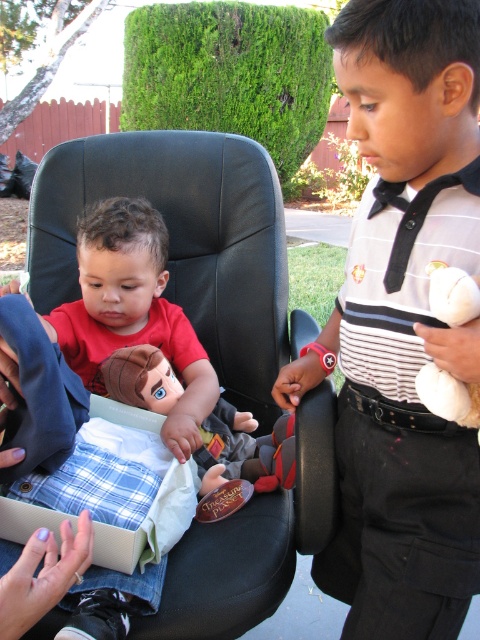
Based on the photo, between white striped shirt at center and black leather armchair at center, which one has less height?

white striped shirt at center is shorter.

Between point (402, 609) and point (201, 321), which one is positioned behind?

The point (201, 321) is more distant.

Is point (399, 620) farther from viewer compared to point (335, 484)?

No, (399, 620) is closer to viewer.

Image resolution: width=480 pixels, height=640 pixels. Identify the location of white striped shirt at center. (403, 323).

Is white striped shirt at center to the left of brown fabric doll at center from the viewer's perspective?

No, white striped shirt at center is not to the left of brown fabric doll at center.

Is point (408, 577) behind point (140, 401)?

No, (408, 577) is closer to viewer.

You are a GUI agent. You are given a task and a screenshot of the screen. Output one action in this format:
    pyautogui.click(x=<x>, y=<y>)
    Task: Click on the white striped shirt at center
    This screenshot has height=640, width=480.
    Given the screenshot: What is the action you would take?
    pyautogui.click(x=403, y=323)

The width and height of the screenshot is (480, 640). What do you see at coordinates (186, 243) in the screenshot? I see `black leather armchair at center` at bounding box center [186, 243].

Which is behind, point (153, 182) or point (264, 488)?

Positioned behind is point (153, 182).

The height and width of the screenshot is (640, 480). I want to click on black leather armchair at center, so click(x=186, y=243).